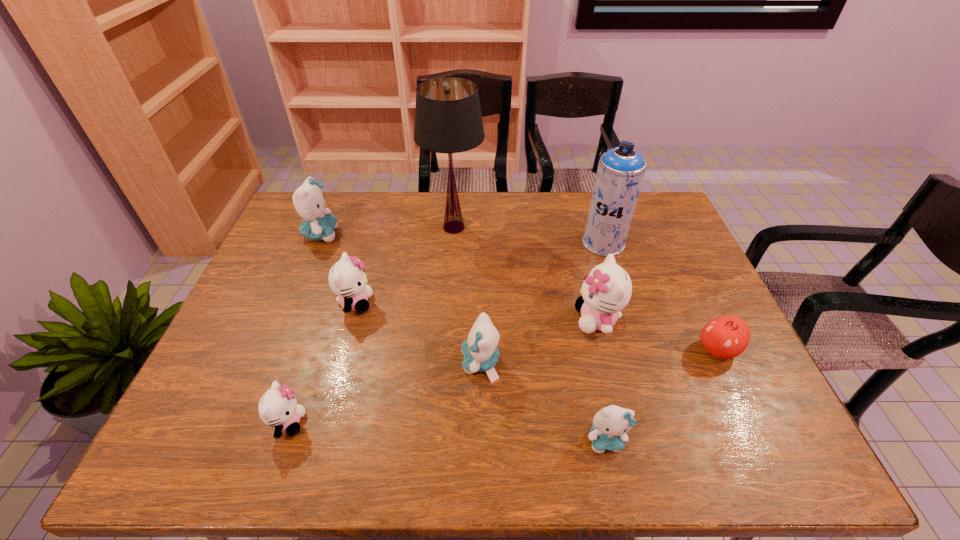
In order to click on apple in this screenshot , I will do `click(726, 337)`.

Locate an element on the screen. The height and width of the screenshot is (540, 960). the nearest white kitten is located at coordinates (278, 407).

Image resolution: width=960 pixels, height=540 pixels. Identify the location of the smallest blue kitten. (610, 425).

You are a GUI agent. You are given a task and a screenshot of the screen. Output one action in this format:
    pyautogui.click(x=<x>, y=<y>)
    Task: Click on the nearest blue kitten
    The width and height of the screenshot is (960, 540).
    Given the screenshot: What is the action you would take?
    pyautogui.click(x=610, y=425)

Locate an element on the screen. blank area located on the front-facing side of the tallest object is located at coordinates (451, 261).

Locate an element on the screen. The image size is (960, 540). free space located 0.080m on the back of the aerosol can is located at coordinates (595, 216).

Locate an element on the screen. This screenshot has height=540, width=960. free space located on the face of the leftmost object is located at coordinates (384, 234).

Locate an element on the screen. Image resolution: width=960 pixels, height=540 pixels. vacant space located on the front-facing side of the rightmost white kitten is located at coordinates (527, 320).

Locate an element on the screen. The width and height of the screenshot is (960, 540). vacant space located 0.350m on the front-facing side of the rightmost white kitten is located at coordinates (446, 320).

You are a GUI agent. You are given a task and a screenshot of the screen. Output one action in this format:
    pyautogui.click(x=<x>, y=<y>)
    Task: Click on the vacant space located 0.110m on the front-facing side of the rightmost white kitten
    
    Given the screenshot: What is the action you would take?
    pyautogui.click(x=534, y=320)